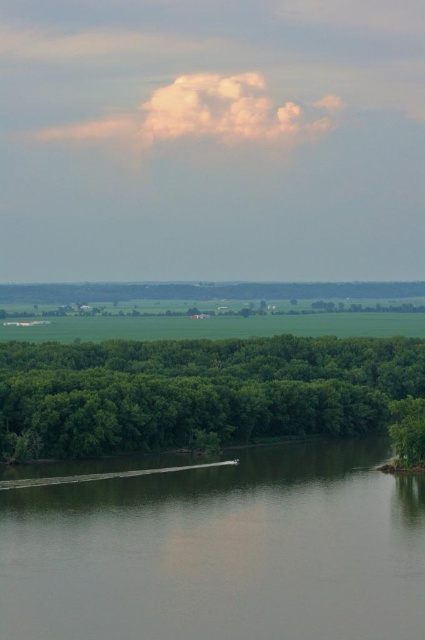
Question: Can you confirm if gray smooth water at lower center is positioned above green leafy trees at lower center?

Choices:
 (A) yes
 (B) no

Answer: (B)

Question: Is gray smooth water at lower center thinner than green leafy trees at lower center?

Choices:
 (A) no
 (B) yes

Answer: (B)

Question: Is gray smooth water at lower center to the left of green leafy trees at lower center from the viewer's perspective?

Choices:
 (A) no
 (B) yes

Answer: (B)

Question: Which point appears closest to the camera in this image?

Choices:
 (A) (119, 486)
 (B) (141, 444)

Answer: (A)

Question: Which point is closer to the camera?

Choices:
 (A) gray smooth water at lower center
 (B) green leafy trees at lower center

Answer: (A)